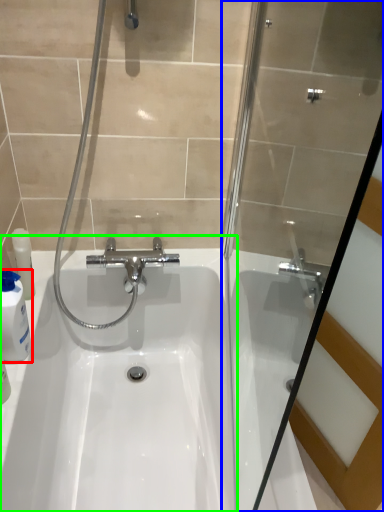
Question: Based on their relative distances, which object is nearer to cleaning product (highlighted by a red box)? Choose from shower door (highlighted by a blue box) and sink (highlighted by a green box).

Choices:
 (A) shower door
 (B) sink

Answer: (B)